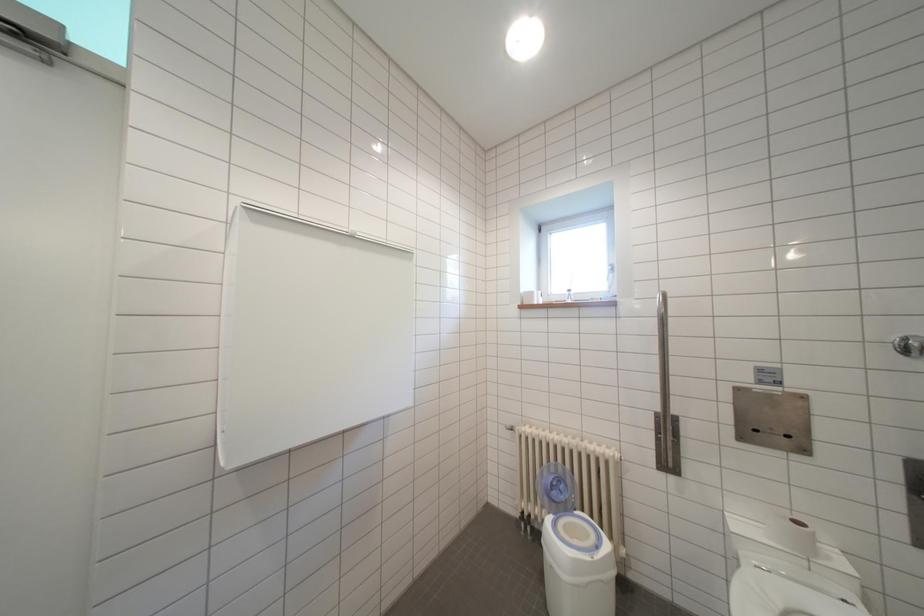
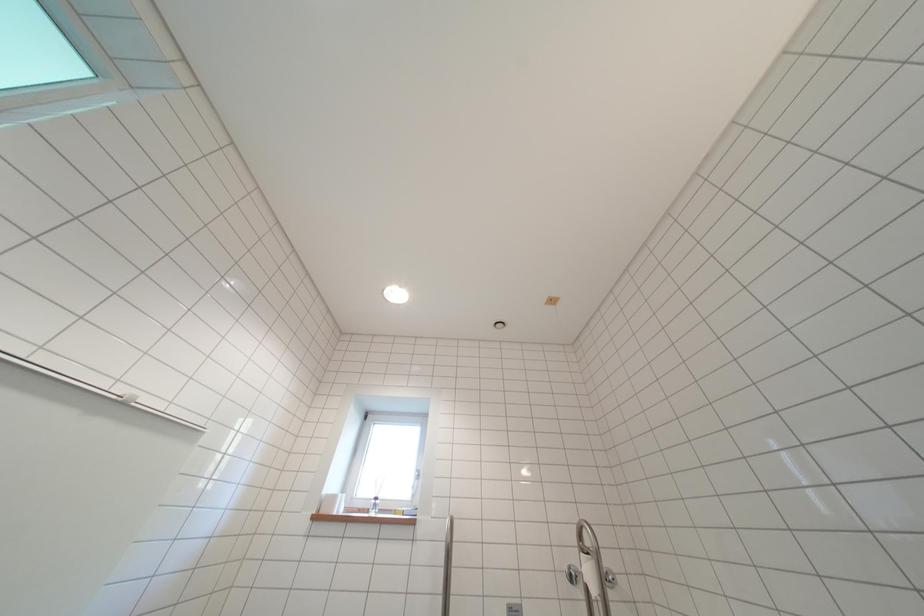
Based on the continuous images, in which direction is the camera rotating?

The camera's rotation is toward right-up.